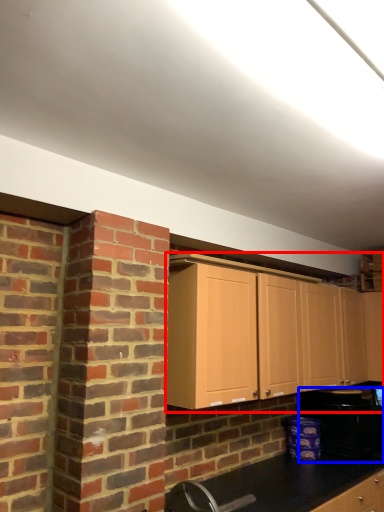
Question: Which object is further to the camera taking this photo, cabinetry (highlighted by a red box) or appliance (highlighted by a blue box)?

Choices:
 (A) cabinetry
 (B) appliance

Answer: (B)